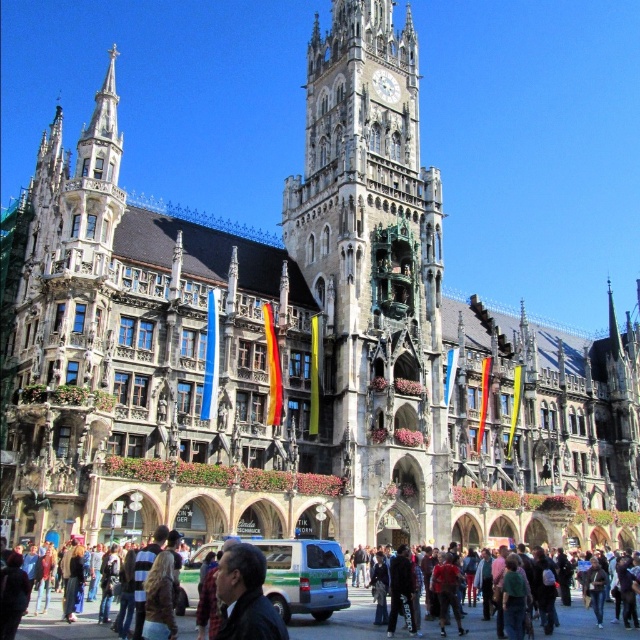
Is point (332, 627) positioned before point (228, 568)?

No, it is not.

Between dark clothing crowd at lower center and dark blue leather jacket at lower center, which one is positioned higher?

Positioned higher is dark blue leather jacket at lower center.

The width and height of the screenshot is (640, 640). Identify the location of dark clothing crowd at lower center. (584, 625).

Can you confirm if golden stone clock tower at center is positioned to the right of dark clothing crowd at lower center?

In fact, golden stone clock tower at center is to the left of dark clothing crowd at lower center.

Does point (380, 419) lie behind point (352, 628)?

That is True.

The width and height of the screenshot is (640, 640). Describe the element at coordinates (372, 276) in the screenshot. I see `golden stone clock tower at center` at that location.

Locate an element on the screen. golden stone clock tower at center is located at coordinates (372, 276).

Is golden stone clock tower at center thinner than dark blue leather jacket at lower center?

No, golden stone clock tower at center is not thinner than dark blue leather jacket at lower center.

Does golden stone clock tower at center have a lesser height compared to dark blue leather jacket at lower center?

No.

At what (x,y) coordinates should I click in order to perform the action: click on golden stone clock tower at center. Please return your answer as a coordinate pair (x, y). Looking at the image, I should click on (372, 276).